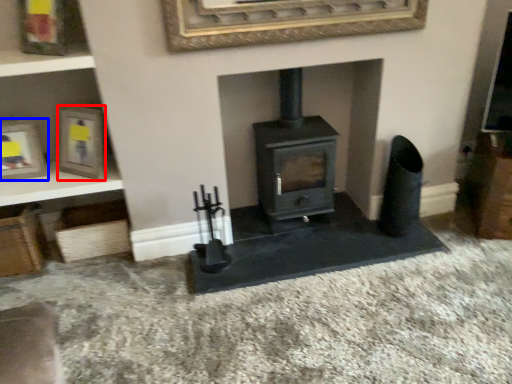
Question: Which object is closer to the camera taking this photo, picture frame (highlighted by a red box) or picture frame (highlighted by a blue box)?

Choices:
 (A) picture frame
 (B) picture frame

Answer: (A)